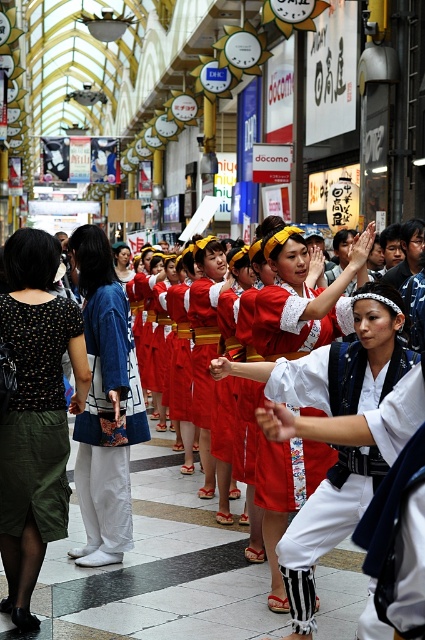
Between point (14, 292) and point (105, 541), which one is positioned in front?

Positioned in front is point (14, 292).

How distant is polka dot blouse at center from blue cotton kimono at left?

polka dot blouse at center is 32.42 inches from blue cotton kimono at left.

Is point (25, 358) less distant than point (107, 509)?

Yes, point (25, 358) is closer to viewer.

Image resolution: width=425 pixels, height=640 pixels. I want to click on polka dot blouse at center, so 36,416.

Which is above, polka dot blouse at center or white cotton kimono at center?

polka dot blouse at center is above.

Is polka dot blouse at center thinner than white cotton kimono at center?

No, polka dot blouse at center is not thinner than white cotton kimono at center.

Which is behind, point (42, 337) or point (388, 460)?

Point (42, 337)

Image resolution: width=425 pixels, height=640 pixels. Find the location of `polka dot blouse at center`. polka dot blouse at center is located at coordinates (36, 416).

Who is taller, white cotton kimono at center or blue cotton kimono at left?

Standing taller between the two is blue cotton kimono at left.

Which is behind, point (342, 444) or point (125, 500)?

Positioned behind is point (125, 500).

Where is `white cotton kimono at center`? The width and height of the screenshot is (425, 640). white cotton kimono at center is located at coordinates (319, 540).